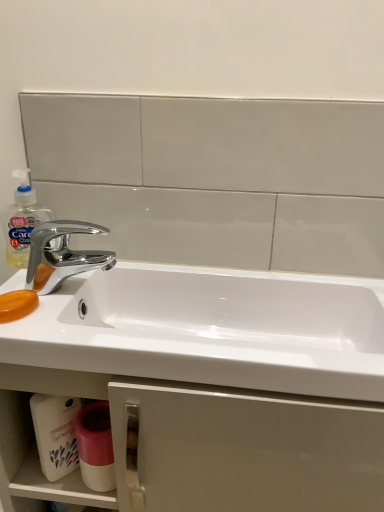
Where is `free space behind orange translucent soap at left`? This screenshot has width=384, height=512. free space behind orange translucent soap at left is located at coordinates (x=53, y=282).